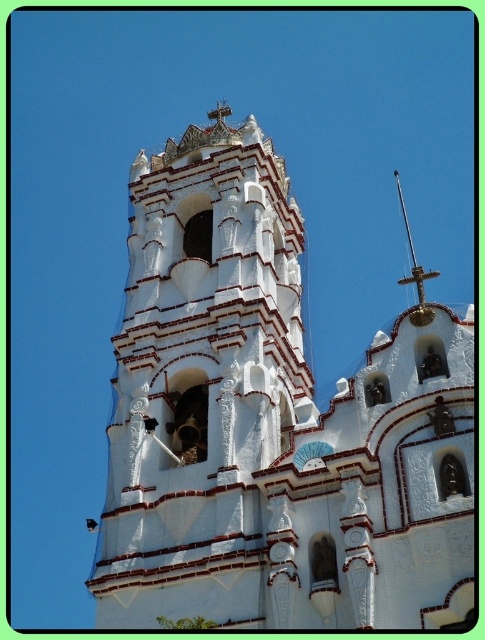
What do you see at coordinates (272, 422) in the screenshot? This screenshot has width=485, height=640. I see `white stucco church at center` at bounding box center [272, 422].

Measure the distance between white stucco church at center and polished brass spire at upper right.

They are 12.13 meters apart.

Is point (406, 481) farther from viewer compared to point (422, 310)?

No, it is not.

What are the coordinates of `white stucco church at center` in the screenshot? It's located at (272, 422).